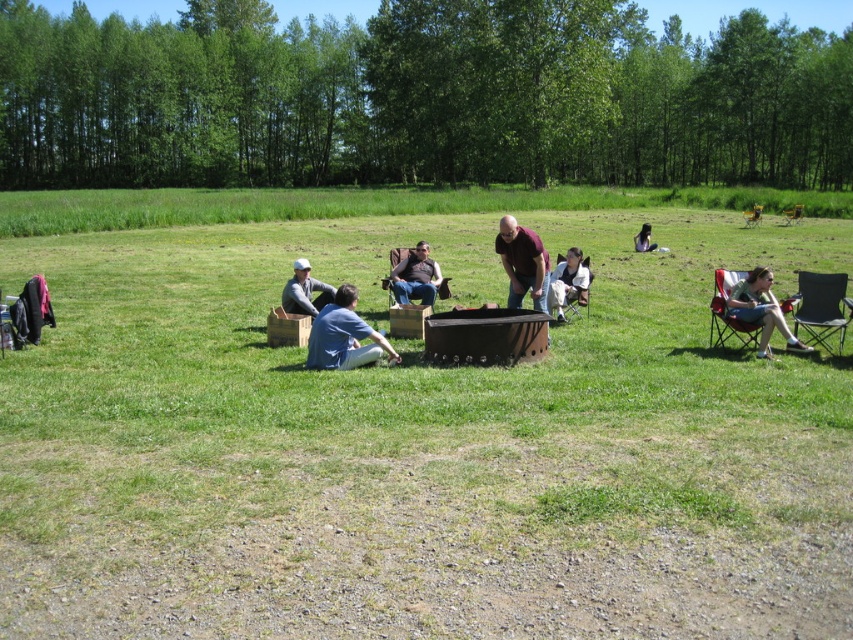
Question: Is green grassy field at center positioned at the back of matte gray jacket at center?

Choices:
 (A) yes
 (B) no

Answer: (A)

Question: Among these points, which one is farthest from the camera?

Choices:
 (A) (430, 336)
 (B) (637, 234)
 (C) (563, 308)
 (D) (753, 192)

Answer: (D)

Question: From the image, what is the correct spatial relationship of blue denim shirt at center in relation to denim jacket at lower right?

Choices:
 (A) below
 (B) above

Answer: (A)

Question: Which object appears closest to the camera in this image?

Choices:
 (A) matte maroon shirt at center
 (B) denim jacket at lower right
 (C) yellow fabric chair at right
 (D) yellow plastic chair at right

Answer: (B)

Question: From the image, what is the correct spatial relationship of denim jacket at lower right in relation to light blue denim jeans at lower right?

Choices:
 (A) left
 (B) right

Answer: (A)

Question: Which of the following is the farthest from the observer?

Choices:
 (A) black fabric chair at right
 (B) black matte fire pit at center
 (C) blue denim shirt at center
 (D) matte brown shirt at center

Answer: (D)